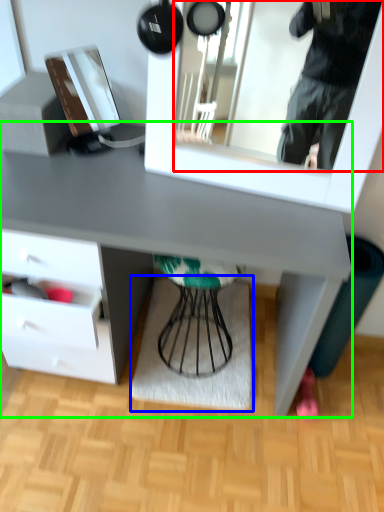
Question: Which object is positioned farthest from mirror (highlighted by a red box)? Select from mat (highlighted by a blue box) and desk (highlighted by a green box).

Choices:
 (A) mat
 (B) desk

Answer: (A)